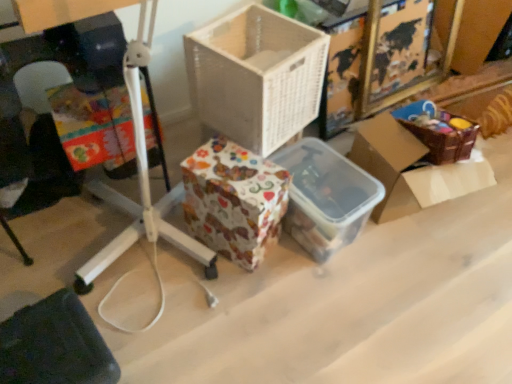
You are a GUI agent. You are given a task and a screenshot of the screen. Output one action in this format:
    pyautogui.click(x=<x>, y=<y>)
    Task: Click on the white wicker basket at center, the second box in the right-to-left sequence
    The height and width of the screenshot is (384, 512).
    Given the screenshot: What is the action you would take?
    pyautogui.click(x=256, y=76)

The height and width of the screenshot is (384, 512). Describe the element at coordinates (411, 169) in the screenshot. I see `brown woven basket at upper right, positioned as the first box in right-to-left order` at that location.

The image size is (512, 384). Describe the element at coordinates (325, 197) in the screenshot. I see `translucent plastic container at center, which is the 2th storage box from left to right` at that location.

Where is `white wicker basket at center, the second box in the right-to-left sequence`? Image resolution: width=512 pixels, height=384 pixels. white wicker basket at center, the second box in the right-to-left sequence is located at coordinates (256, 76).

From the image's perspective, is brown woven basket at upper right, positioned as the first box in right-to-left order, located above or below dark fabric at lower left?

brown woven basket at upper right, positioned as the first box in right-to-left order, is situated higher than dark fabric at lower left in the image.

From a real-world perspective, which is physically below, brown woven basket at upper right, positioned as the first box in right-to-left order, or dark fabric at lower left?

dark fabric at lower left, from a real-world perspective.

In the scene shown: Are brown woven basket at upper right, positioned as the first box in right-to-left order, and dark fabric at lower left located far from each other?

Indeed, brown woven basket at upper right, positioned as the first box in right-to-left order, is not near dark fabric at lower left.

Considering the sizes of objects brown woven basket at upper right, positioned as the first box in right-to-left order, and dark fabric at lower left in the image provided, who is thinner, brown woven basket at upper right, positioned as the first box in right-to-left order, or dark fabric at lower left?

Answer: dark fabric at lower left is thinner.

Is dark fabric at lower left touching white wicker basket at center, the second box in the right-to-left sequence?

No, dark fabric at lower left is not beside white wicker basket at center, the second box in the right-to-left sequence.

Locate an element on the screen. The height and width of the screenshot is (384, 512). the 2nd box above the dark fabric at lower left (from the image's perspective) is located at coordinates 256,76.

Is dark fabric at lower left taller or shorter than white wicker basket at center, the second box in the right-to-left sequence?

dark fabric at lower left is shorter than white wicker basket at center, the second box in the right-to-left sequence.

How distant is patterned paper storage box at center, positioned as the 2th storage box in right-to-left order, from translucent plastic container at center, the first storage box in the right-to-left sequence?

patterned paper storage box at center, positioned as the 2th storage box in right-to-left order, is 8.20 inches away from translucent plastic container at center, the first storage box in the right-to-left sequence.

Does patterned paper storage box at center, positioned as the 2th storage box in right-to-left order, have a greater height compared to translucent plastic container at center, which is the 2th storage box from left to right?

Yes.

Does patterned paper storage box at center, which ranks as the 1th storage box in left-to-right order, have a larger size compared to translucent plastic container at center, the first storage box in the right-to-left sequence?

No.

Would you say brown woven basket at upper right, the 2th box positioned from the left, is a long distance from translucent plastic container at center, which is the 2th storage box from left to right?

That's not correct — brown woven basket at upper right, the 2th box positioned from the left, is a little close to translucent plastic container at center, which is the 2th storage box from left to right.

Does brown woven basket at upper right, the 2th box positioned from the left, appear on the left side of translucent plastic container at center, the first storage box in the right-to-left sequence?

In fact, brown woven basket at upper right, the 2th box positioned from the left, is to the right of translucent plastic container at center, the first storage box in the right-to-left sequence.

Considering the sizes of brown woven basket at upper right, the 2th box positioned from the left, and translucent plastic container at center, the first storage box in the right-to-left sequence, in the image, is brown woven basket at upper right, the 2th box positioned from the left, wider or thinner than translucent plastic container at center, the first storage box in the right-to-left sequence,?

In the image, brown woven basket at upper right, the 2th box positioned from the left, appears to be wider than translucent plastic container at center, the first storage box in the right-to-left sequence.

Is the position of brown woven basket at upper right, positioned as the first box in right-to-left order, more distant than that of translucent plastic container at center, which is the 2th storage box from left to right?

That is True.

Is dark fabric at lower left turned away from patterned paper storage box at center, which ranks as the 1th storage box in left-to-right order?

No, dark fabric at lower left is not facing away from patterned paper storage box at center, which ranks as the 1th storage box in left-to-right order.

In the image, is dark fabric at lower left positioned in front of or behind patterned paper storage box at center, positioned as the 2th storage box in right-to-left order?

In the image, dark fabric at lower left appears in front of patterned paper storage box at center, positioned as the 2th storage box in right-to-left order.

Considering the sizes of objects dark fabric at lower left and patterned paper storage box at center, which ranks as the 1th storage box in left-to-right order, in the image provided, who is thinner, dark fabric at lower left or patterned paper storage box at center, which ranks as the 1th storage box in left-to-right order,?

patterned paper storage box at center, which ranks as the 1th storage box in left-to-right order, is thinner.

Is point (335, 226) more distant than point (68, 297)?

Yes, point (335, 226) is farther from viewer.

Is translucent plastic container at center, the first storage box in the right-to-left sequence, at the left side of dark fabric at lower left?

No, translucent plastic container at center, the first storage box in the right-to-left sequence, is not to the left of dark fabric at lower left.

How many degrees apart are the facing directions of translucent plastic container at center, the first storage box in the right-to-left sequence, and dark fabric at lower left?

The angular difference between translucent plastic container at center, the first storage box in the right-to-left sequence, and dark fabric at lower left is 0.146 degrees.

Who is more distant, translucent plastic container at center, the first storage box in the right-to-left sequence, or dark fabric at lower left?

translucent plastic container at center, the first storage box in the right-to-left sequence, is further from the camera.

Which of these two, patterned paper storage box at center, positioned as the 2th storage box in right-to-left order, or dark fabric at lower left, stands shorter?

dark fabric at lower left is shorter.

Is patterned paper storage box at center, which ranks as the 1th storage box in left-to-right order, facing away from dark fabric at lower left?

patterned paper storage box at center, which ranks as the 1th storage box in left-to-right order, does not have its back to dark fabric at lower left.

Is the position of patterned paper storage box at center, positioned as the 2th storage box in right-to-left order, more distant than that of dark fabric at lower left?

Yes, patterned paper storage box at center, positioned as the 2th storage box in right-to-left order, is behind dark fabric at lower left.

Which is behind, point (253, 226) or point (46, 383)?

Positioned behind is point (253, 226).

This screenshot has width=512, height=384. In order to click on wide in front of the brown woven basket at upper right, the 2th box positioned from the left in this screenshot , I will do `click(55, 345)`.

Find the location of `the 1st box behind when counting from the dark fabric at lower left`. the 1st box behind when counting from the dark fabric at lower left is located at coordinates (256, 76).

From the image, which object appears to be nearer to white wicker basket at center, the 1th box when ordered from left to right, brown woven basket at upper right, positioned as the first box in right-to-left order, or patterned paper storage box at center, which ranks as the 1th storage box in left-to-right order?

The object closer to white wicker basket at center, the 1th box when ordered from left to right, is patterned paper storage box at center, which ranks as the 1th storage box in left-to-right order.

Estimate the real-world distances between objects in this image. Which object is closer to translucent plastic container at center, which is the 2th storage box from left to right, brown woven basket at upper right, the 2th box positioned from the left, or dark fabric at lower left?

Among the two, brown woven basket at upper right, the 2th box positioned from the left, is located nearer to translucent plastic container at center, which is the 2th storage box from left to right.

From the image, which object appears to be farther from white wicker basket at center, the second box in the right-to-left sequence, dark fabric at lower left or patterned paper storage box at center, positioned as the 2th storage box in right-to-left order?

dark fabric at lower left is positioned further to the anchor white wicker basket at center, the second box in the right-to-left sequence.

From the picture: Considering their positions, is white wicker basket at center, the 1th box when ordered from left to right, positioned further to brown woven basket at upper right, positioned as the first box in right-to-left order, than dark fabric at lower left?

dark fabric at lower left.

Considering their positions, is translucent plastic container at center, the first storage box in the right-to-left sequence, positioned closer to brown woven basket at upper right, positioned as the first box in right-to-left order, than dark fabric at lower left?

Based on the image, translucent plastic container at center, the first storage box in the right-to-left sequence, appears to be nearer to brown woven basket at upper right, positioned as the first box in right-to-left order.

From the image, which object appears to be nearer to white wicker basket at center, the second box in the right-to-left sequence, patterned paper storage box at center, positioned as the 2th storage box in right-to-left order, or translucent plastic container at center, which is the 2th storage box from left to right?

patterned paper storage box at center, positioned as the 2th storage box in right-to-left order, is closer to white wicker basket at center, the second box in the right-to-left sequence.

From the image, which object appears to be nearer to translucent plastic container at center, which is the 2th storage box from left to right, brown woven basket at upper right, the 2th box positioned from the left, or patterned paper storage box at center, positioned as the 2th storage box in right-to-left order?

Based on the image, brown woven basket at upper right, the 2th box positioned from the left, appears to be nearer to translucent plastic container at center, which is the 2th storage box from left to right.

Based on their spatial positions, is patterned paper storage box at center, which ranks as the 1th storage box in left-to-right order, or dark fabric at lower left further from white wicker basket at center, the second box in the right-to-left sequence?

dark fabric at lower left is positioned further to the anchor white wicker basket at center, the second box in the right-to-left sequence.

At what (x,y) coordinates should I click in order to perform the action: click on box between dark fabric at lower left and brown woven basket at upper right, the 2th box positioned from the left. Please return your answer as a coordinate pair (x, y). Looking at the image, I should click on (256, 76).

You are a GUI agent. You are given a task and a screenshot of the screen. Output one action in this format:
    pyautogui.click(x=<x>, y=<y>)
    Task: Click on the storage box located between dark fabric at lower left and translucent plastic container at center, the first storage box in the right-to-left sequence, in the left-right direction
    Image resolution: width=512 pixels, height=384 pixels.
    Given the screenshot: What is the action you would take?
    pyautogui.click(x=234, y=200)

Identify the location of storage box between white wicker basket at center, the 1th box when ordered from left to right, and brown woven basket at upper right, the 2th box positioned from the left. (325, 197).

Find the location of `box between patterned paper storage box at center, positioned as the 2th storage box in right-to-left order, and brown woven basket at upper right, positioned as the first box in right-to-left order, in the horizontal direction`. box between patterned paper storage box at center, positioned as the 2th storage box in right-to-left order, and brown woven basket at upper right, positioned as the first box in right-to-left order, in the horizontal direction is located at coordinates (256, 76).